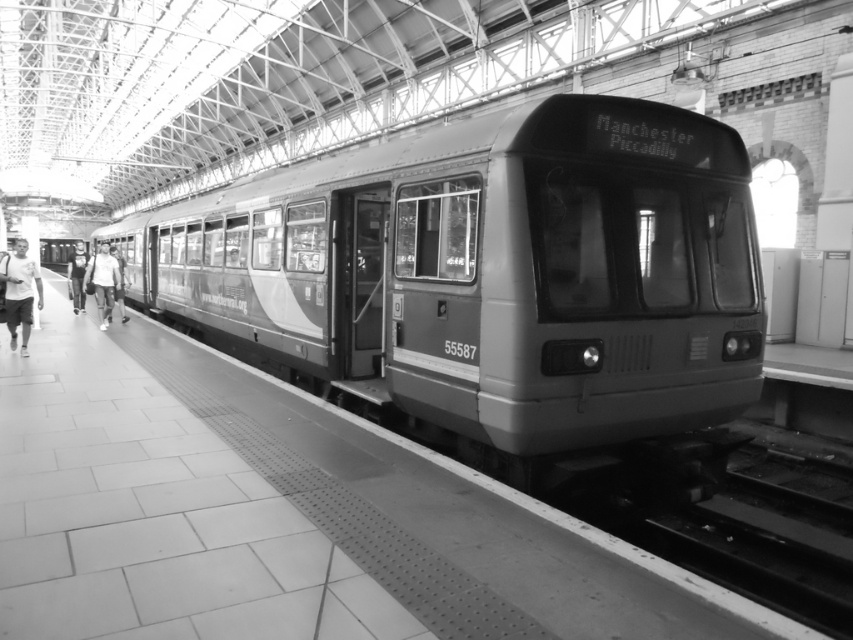
You are a photographer standing at the train station. You want to take a picture of both the metallic gray train at center and the denim jacket at center. Which object should you focus on first if you want to capture them both in the same frame without moving the camera?

The metallic gray train at center is not as tall as the denim jacket at center, so you should focus on the denim jacket at center first to ensure it fits within the frame.

You are standing at the entrance of the train station and want to locate the metallic gray train at center. According to the 2D coordinates provided, where should you look relative to the station entrance?

The metallic gray train at center is located at coordinates 0.428 along the x axis and 0.578 along the y axis, so you should look towards the center of the image where those coordinates intersect.

You are a passenger waiting at the train station. You see a metallic gray train at center and a light gray shirt at left. Which object is closer to the left side of the platform?

The light gray shirt at left is closer to the left side of the platform because the metallic gray train at center is to the right of it.